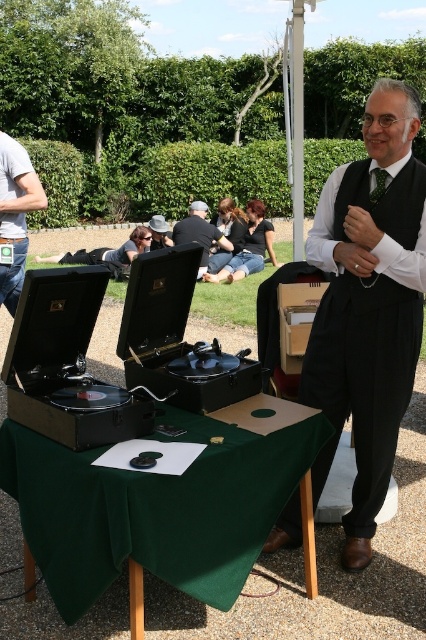
You are organizing a vintage gramophone exhibition and need to ensure there is enough space between the green fabric table at center and the dark gray suit at center for visitors to walk comfortably. The minimum required width for the walkway is 60 cm. Can you confirm if the current setup allows this?

The green fabric table at center is wider than the dark gray suit at center. However, the provided information does not specify the exact width of either object or the distance between them. Therefore, it is impossible to determine if the walkway meets the 60 cm requirement based on the given details.

You are standing at point 0.5, 0.5 in the image. Which direction should you move to reach the green fabric table at center?

The green fabric table at center is located at point (155, 508). Since you are at point (213, 320), you should move northeast to reach it.